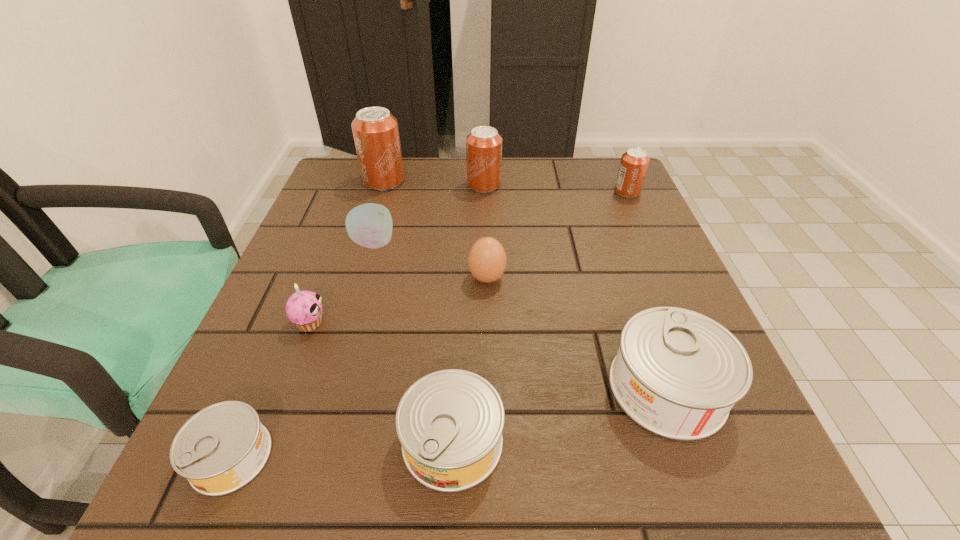
Point out which silver can is positioned as the nearest to the boiled egg. Please provide its 2D coordinates. Your answer should be formatted as a tuple, i.e. [(x, y)], where the tuple contains the x and y coordinates of a point satisfying the conditions above.

[(677, 373)]

You are a GUI agent. You are given a task and a screenshot of the screen. Output one action in this format:
    pyautogui.click(x=<x>, y=<y>)
    Task: Click on the vacant region that satisfies the following two spatial constraints: 1. on the front side of the smallest orange can; 2. on the face of the sixth farthest object
    The image size is (960, 540).
    Given the screenshot: What is the action you would take?
    [685, 323]

Identify the location of free space that satisfies the following two spatial constraints: 1. on the face of the fourth nearest object; 2. on the left side of the second silver can from left to right. The image size is (960, 540). (266, 441).

Locate an element on the screen. This screenshot has width=960, height=540. vacant point that satisfies the following two spatial constraints: 1. on the front side of the eighth shortest object; 2. on the right side of the leftmost orange can is located at coordinates click(383, 185).

Where is `vacant area that satisfies the following two spatial constraints: 1. on the front side of the brown boiled egg; 2. on the face of the sixth farthest object`? This screenshot has width=960, height=540. vacant area that satisfies the following two spatial constraints: 1. on the front side of the brown boiled egg; 2. on the face of the sixth farthest object is located at coordinates (488, 323).